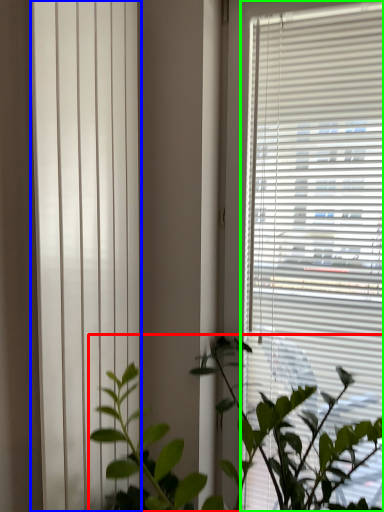
Question: Which is farther away from houseplant (highlighted by a red box)? shutter (highlighted by a blue box) or window blind (highlighted by a green box)?

Choices:
 (A) shutter
 (B) window blind

Answer: (A)